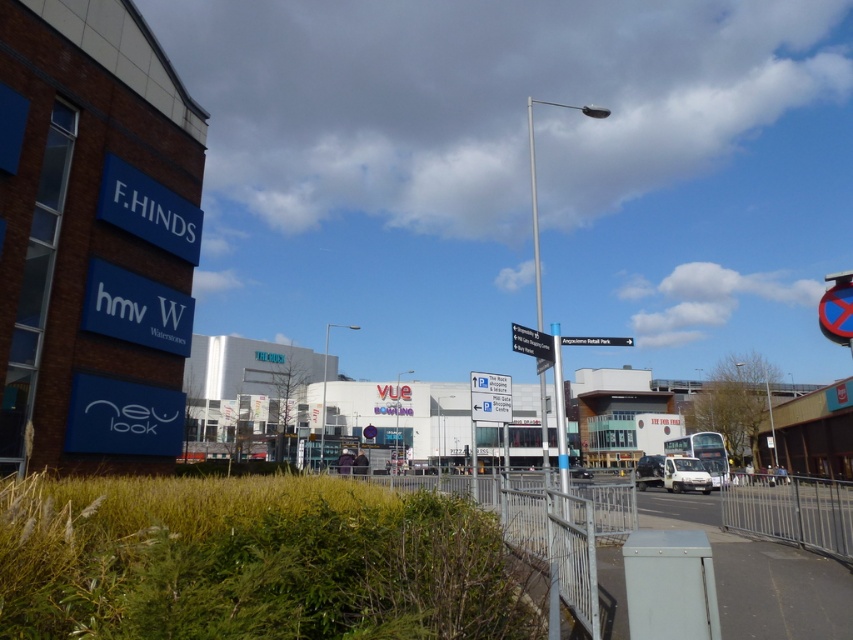
Question: Which point is closer to the camera taking this photo?

Choices:
 (A) (525, 326)
 (B) (686, 484)
 (C) (833, 328)

Answer: (C)

Question: Can you confirm if white matte van at lower right is positioned above white glossy van at center?

Choices:
 (A) no
 (B) yes

Answer: (B)

Question: Is white matte van at lower right behind white glossy van at center?

Choices:
 (A) yes
 (B) no

Answer: (B)

Question: Can you confirm if red plastic sign at upper right is smaller than metallic rectangular sign at center?

Choices:
 (A) no
 (B) yes

Answer: (B)

Question: Which point is farther from the camera taking this photo?

Choices:
 (A) (534, 330)
 (B) (695, 458)

Answer: (B)

Question: Which of the following is the farthest from the observer?

Choices:
 (A) white glossy van at center
 (B) white matte van at lower right
 (C) red plastic sign at upper right

Answer: (A)